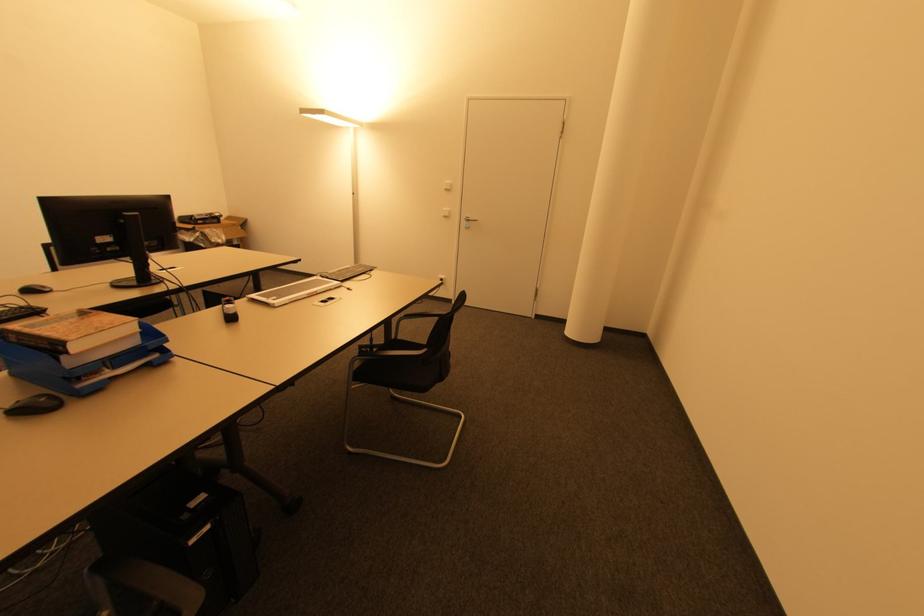
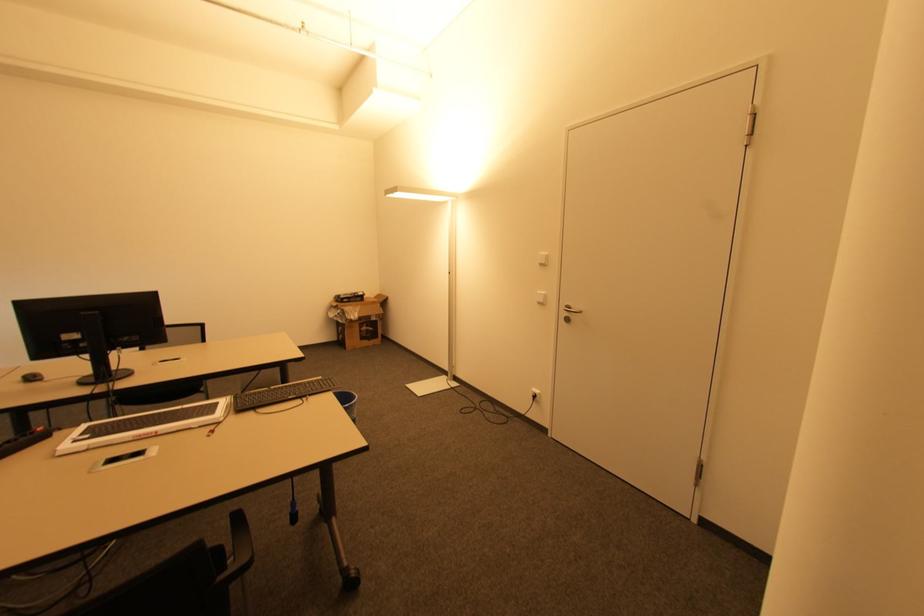
In the second image, find the point that corresponds to (x=444, y=277) in the first image.

(539, 392)